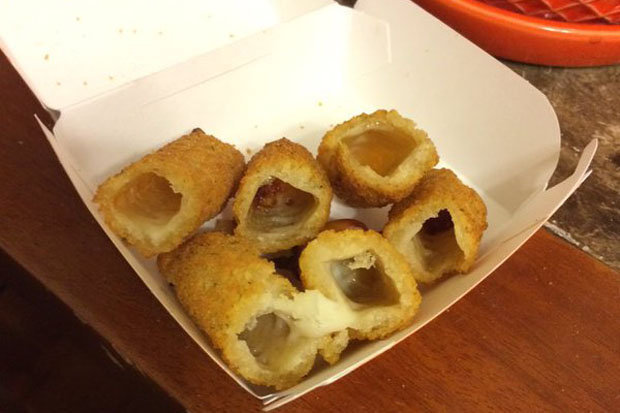
You are a GUI agent. You are given a task and a screenshot of the screen. Output one action in this format:
    pyautogui.click(x=<x>, y=<y>)
    Task: Click on the box
    Image resolution: width=620 pixels, height=413 pixels.
    Given the screenshot: What is the action you would take?
    pyautogui.click(x=457, y=134)